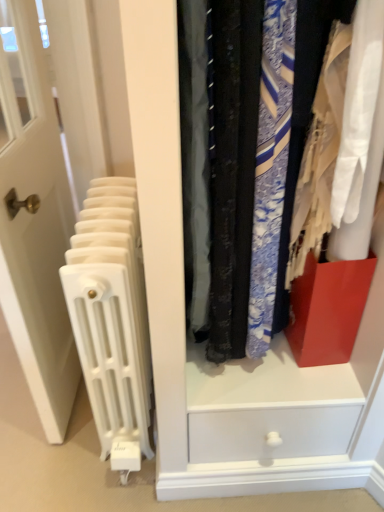
Question: From the image's perspective, is white glossy door at left above matte plastic drawer at center?

Choices:
 (A) no
 (B) yes

Answer: (A)

Question: Considering the relative sizes of white glossy door at left and matte plastic drawer at center in the image provided, is white glossy door at left wider than matte plastic drawer at center?

Choices:
 (A) yes
 (B) no

Answer: (B)

Question: From a real-world perspective, is white glossy door at left on matte plastic drawer at center?

Choices:
 (A) no
 (B) yes

Answer: (A)

Question: Is white glossy door at left to the right of matte plastic drawer at center from the viewer's perspective?

Choices:
 (A) yes
 (B) no

Answer: (B)

Question: Is white glossy door at left oriented towards matte plastic drawer at center?

Choices:
 (A) yes
 (B) no

Answer: (B)

Question: Is white glossy door at left outside of matte plastic drawer at center?

Choices:
 (A) yes
 (B) no

Answer: (A)

Question: Is white glossy door at left far from white plastic radiator at left?

Choices:
 (A) no
 (B) yes

Answer: (A)

Question: Is white glossy door at left next to white plastic radiator at left?

Choices:
 (A) yes
 (B) no

Answer: (B)

Question: Does white glossy door at left have a lesser height compared to white plastic radiator at left?

Choices:
 (A) yes
 (B) no

Answer: (B)

Question: Is white glossy door at left located outside white plastic radiator at left?

Choices:
 (A) yes
 (B) no

Answer: (A)

Question: Can white plastic radiator at left be found inside white glossy door at left?

Choices:
 (A) yes
 (B) no

Answer: (B)

Question: Is white glossy door at left bigger than white plastic radiator at left?

Choices:
 (A) yes
 (B) no

Answer: (A)

Question: Is white plastic radiator at left located within matte plastic drawer at center?

Choices:
 (A) yes
 (B) no

Answer: (B)